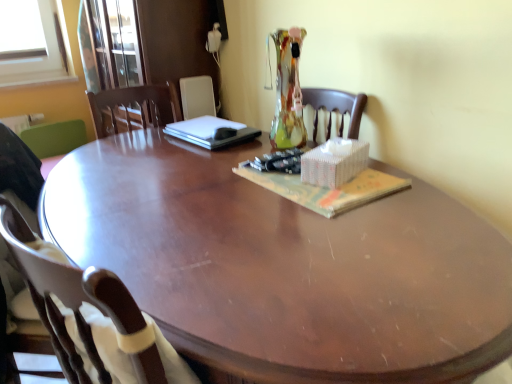
Question: Are green fabric chair at left, the 3th chair viewed from the front, and glossy wood desk at center far apart?

Choices:
 (A) no
 (B) yes

Answer: (B)

Question: Is green fabric chair at left, the 1th chair from the back, oriented towards glossy wood desk at center?

Choices:
 (A) yes
 (B) no

Answer: (A)

Question: Is green fabric chair at left, the 3th chair viewed from the front, with glossy wood desk at center?

Choices:
 (A) yes
 (B) no

Answer: (B)

Question: Is green fabric chair at left, the 3th chair viewed from the front, to the right of glossy wood desk at center from the viewer's perspective?

Choices:
 (A) no
 (B) yes

Answer: (A)

Question: Is glossy wood desk at center completely or partially inside green fabric chair at left, the 3th chair viewed from the front?

Choices:
 (A) no
 (B) yes

Answer: (A)

Question: Is green fabric chair at left, the 3th chair viewed from the front, smaller than glossy wood desk at center?

Choices:
 (A) yes
 (B) no

Answer: (A)

Question: From the image's perspective, is glossy wood desk at center beneath matte paper magazine at center?

Choices:
 (A) no
 (B) yes

Answer: (B)

Question: Can you confirm if glossy wood desk at center is wider than matte paper magazine at center?

Choices:
 (A) yes
 (B) no

Answer: (A)

Question: Considering the relative positions of glossy wood desk at center and matte paper magazine at center in the image provided, is glossy wood desk at center to the right of matte paper magazine at center from the viewer's perspective?

Choices:
 (A) no
 (B) yes

Answer: (A)

Question: Considering the relative sizes of glossy wood desk at center and matte paper magazine at center in the image provided, is glossy wood desk at center taller than matte paper magazine at center?

Choices:
 (A) no
 (B) yes

Answer: (B)

Question: Is the depth of glossy wood desk at center less than that of matte paper magazine at center?

Choices:
 (A) no
 (B) yes

Answer: (B)

Question: Could you tell me if glossy wood desk at center is facing matte paper magazine at center?

Choices:
 (A) yes
 (B) no

Answer: (B)

Question: Is matte paper magazine at center in front of sleek black laptop at center?

Choices:
 (A) no
 (B) yes

Answer: (B)